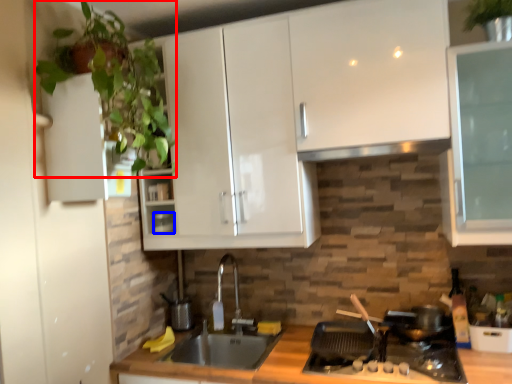
Question: Which object appears farthest to the camera in this image, plant (highlighted by a red box) or appliance (highlighted by a blue box)?

Choices:
 (A) plant
 (B) appliance

Answer: (B)